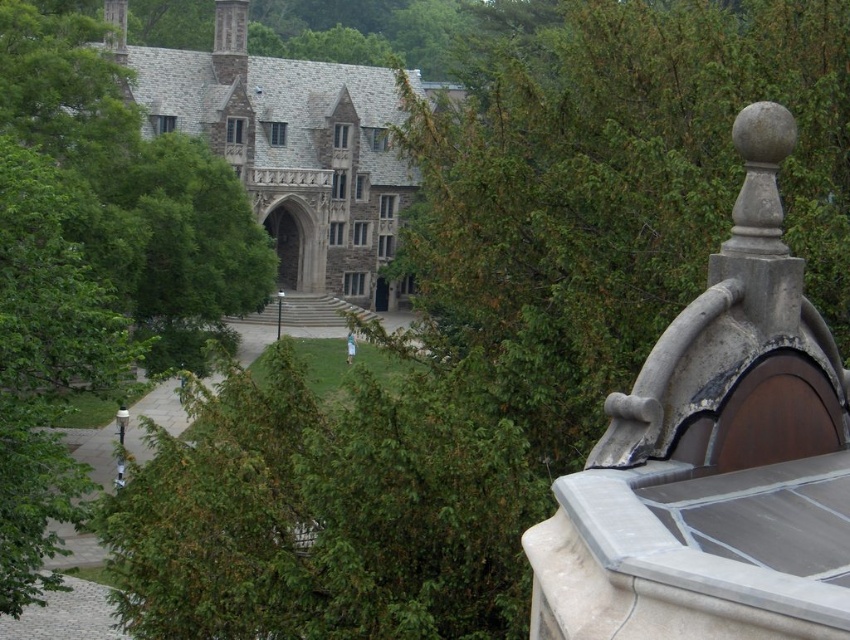
You are a drone operator tasked with flying a drone from the green leafy tree at upper center to the gray stone church at upper left. The drone has a maximum flight range of 20 meters. Can the drone complete this journey without needing to recharge?

The distance between the green leafy tree at upper center and the gray stone church at upper left is 21.01 meters, which exceeds the drone operator drone has a maximum flight range of 20 meters. Therefore, the drone cannot complete the journey without recharging.

You are an architect assessing the building layout. Which object, the green leafy tree at center or the gray stone church at upper left, occupies a larger area in the image?

The gray stone church at upper left is larger than the green leafy tree at center, so the gray stone church at upper left occupies a larger area in the image.